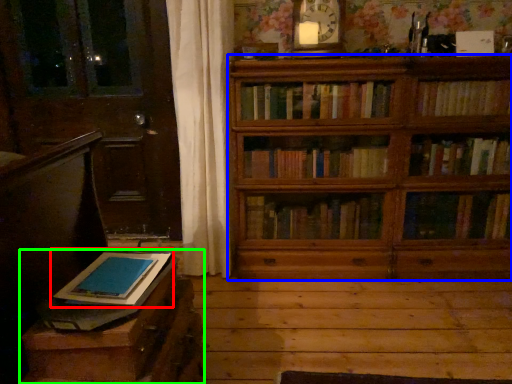
Question: Estimate the real-world distances between objects in this image. Which object is farther from book (highlighted by a red box), bookcase (highlighted by a blue box) or table (highlighted by a green box)?

Choices:
 (A) bookcase
 (B) table

Answer: (A)